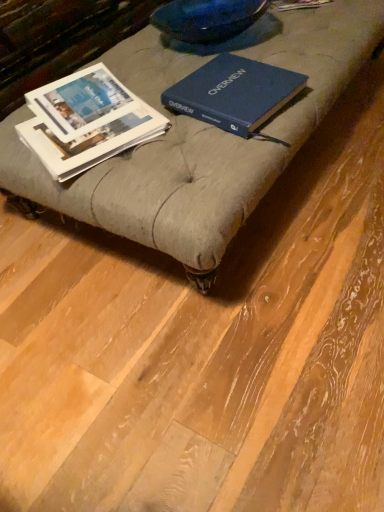
Question: Is blue hardcover book at center, marked as the 1th book in a right-to-left arrangement, at the left side of white paper book at left, which appears as the 1th book when viewed from the left?

Choices:
 (A) yes
 (B) no

Answer: (B)

Question: From the image's perspective, is blue hardcover book at center, the second book when ordered from left to right, over white paper book at left, the 2th book viewed from the right?

Choices:
 (A) no
 (B) yes

Answer: (B)

Question: Can you confirm if blue hardcover book at center, marked as the 1th book in a right-to-left arrangement, is taller than white paper book at left, which appears as the 1th book when viewed from the left?

Choices:
 (A) yes
 (B) no

Answer: (A)

Question: Is blue hardcover book at center, the second book when ordered from left to right, thinner than white paper book at left, which appears as the 1th book when viewed from the left?

Choices:
 (A) yes
 (B) no

Answer: (A)

Question: Are blue hardcover book at center, the second book when ordered from left to right, and white paper book at left, which appears as the 1th book when viewed from the left, beside each other?

Choices:
 (A) yes
 (B) no

Answer: (B)

Question: Is white paper book at left, the 2th book viewed from the right, taller or shorter than blue hardcover book at center, the second book when ordered from left to right?

Choices:
 (A) short
 (B) tall

Answer: (A)

Question: In the image, is white paper book at left, which appears as the 1th book when viewed from the left, on the left side or the right side of blue hardcover book at center, marked as the 1th book in a right-to-left arrangement?

Choices:
 (A) left
 (B) right

Answer: (A)

Question: Would you say white paper book at left, the 2th book viewed from the right, is inside or outside blue hardcover book at center, the second book when ordered from left to right?

Choices:
 (A) inside
 (B) outside

Answer: (B)

Question: From the image's perspective, is white paper book at left, the 2th book viewed from the right, positioned above or below blue hardcover book at center, marked as the 1th book in a right-to-left arrangement?

Choices:
 (A) below
 (B) above

Answer: (A)

Question: In terms of width, does blue hardcover book at center, marked as the 1th book in a right-to-left arrangement, look wider or thinner when compared to white paper book at left, the 2th book viewed from the right?

Choices:
 (A) thin
 (B) wide

Answer: (A)

Question: Considering the positions of blue hardcover book at center, marked as the 1th book in a right-to-left arrangement, and white paper book at left, the 2th book viewed from the right, in the image, is blue hardcover book at center, marked as the 1th book in a right-to-left arrangement, taller or shorter than white paper book at left, the 2th book viewed from the right,?

Choices:
 (A) short
 (B) tall

Answer: (B)

Question: Does point (220, 89) appear closer or farther from the camera than point (82, 79)?

Choices:
 (A) farther
 (B) closer

Answer: (B)

Question: Do you think blue hardcover book at center, the second book when ordered from left to right, is within white paper book at left, the 2th book viewed from the right, or outside of it?

Choices:
 (A) outside
 (B) inside

Answer: (A)

Question: From the image's perspective, is matte gray ottoman at center above or below blue hardcover book at center, marked as the 1th book in a right-to-left arrangement?

Choices:
 (A) below
 (B) above

Answer: (B)

Question: In terms of height, does matte gray ottoman at center look taller or shorter compared to blue hardcover book at center, the second book when ordered from left to right?

Choices:
 (A) tall
 (B) short

Answer: (B)